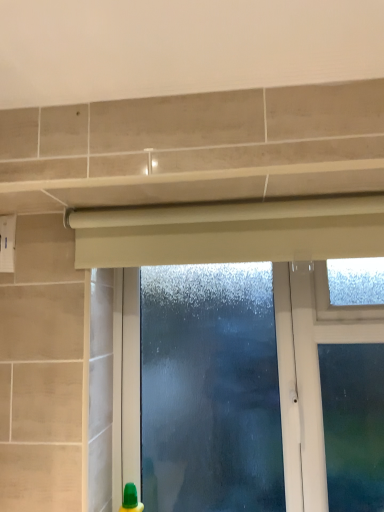
Question: Does frosted glass window at center appear on the left side of beige matte curtain at upper center?

Choices:
 (A) no
 (B) yes

Answer: (A)

Question: Is frosted glass window at center positioned behind beige matte curtain at upper center?

Choices:
 (A) no
 (B) yes

Answer: (B)

Question: Is frosted glass window at center bigger than beige matte curtain at upper center?

Choices:
 (A) yes
 (B) no

Answer: (A)

Question: From the image's perspective, does frosted glass window at center appear lower than beige matte curtain at upper center?

Choices:
 (A) no
 (B) yes

Answer: (B)

Question: Is frosted glass window at center shorter than beige matte curtain at upper center?

Choices:
 (A) yes
 (B) no

Answer: (B)

Question: From the image's perspective, does frosted glass window at center appear higher than beige matte curtain at upper center?

Choices:
 (A) no
 (B) yes

Answer: (A)

Question: Is beige matte curtain at upper center directly adjacent to frosted glass window at center?

Choices:
 (A) yes
 (B) no

Answer: (A)

Question: Is beige matte curtain at upper center at the right side of frosted glass window at center?

Choices:
 (A) yes
 (B) no

Answer: (B)

Question: Is beige matte curtain at upper center shorter than frosted glass window at center?

Choices:
 (A) yes
 (B) no

Answer: (A)

Question: From a real-world perspective, does beige matte curtain at upper center sit lower than frosted glass window at center?

Choices:
 (A) no
 (B) yes

Answer: (A)

Question: From the image's perspective, does beige matte curtain at upper center appear lower than frosted glass window at center?

Choices:
 (A) yes
 (B) no

Answer: (B)

Question: Is beige matte curtain at upper center not within frosted glass window at center?

Choices:
 (A) yes
 (B) no

Answer: (A)

Question: Would you say frosted glass window at center is inside or outside beige matte curtain at upper center?

Choices:
 (A) inside
 (B) outside

Answer: (B)